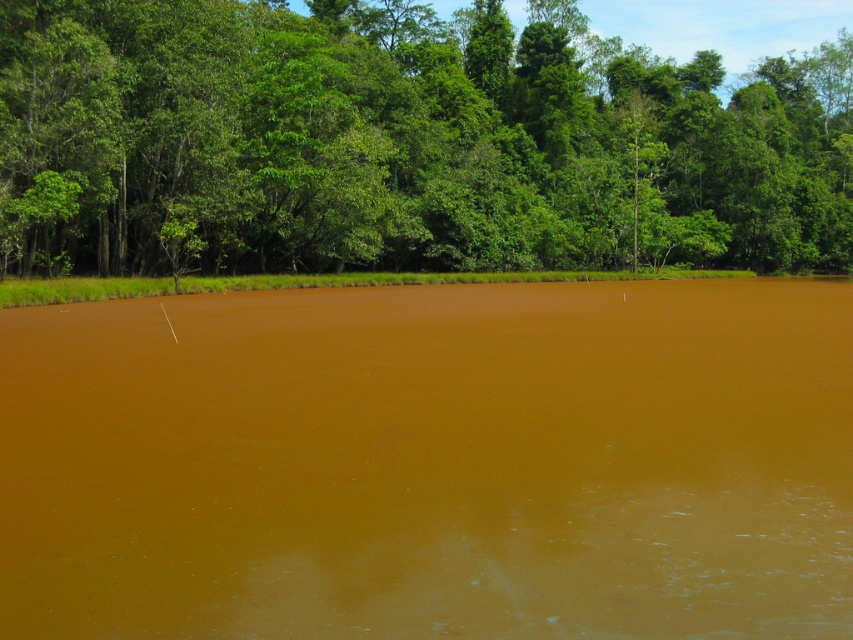
Question: Which point is closer to the camera?

Choices:
 (A) (358, 419)
 (B) (149, 12)

Answer: (A)

Question: Is brown matte lake at center to the left of green leafy tree at upper center from the viewer's perspective?

Choices:
 (A) no
 (B) yes

Answer: (B)

Question: Which of the following is the closest to the observer?

Choices:
 (A) brown matte lake at center
 (B) green leafy tree at upper center

Answer: (A)

Question: Is brown matte lake at center bigger than green leafy tree at upper center?

Choices:
 (A) no
 (B) yes

Answer: (A)

Question: Does brown matte lake at center appear over green leafy tree at upper center?

Choices:
 (A) yes
 (B) no

Answer: (B)